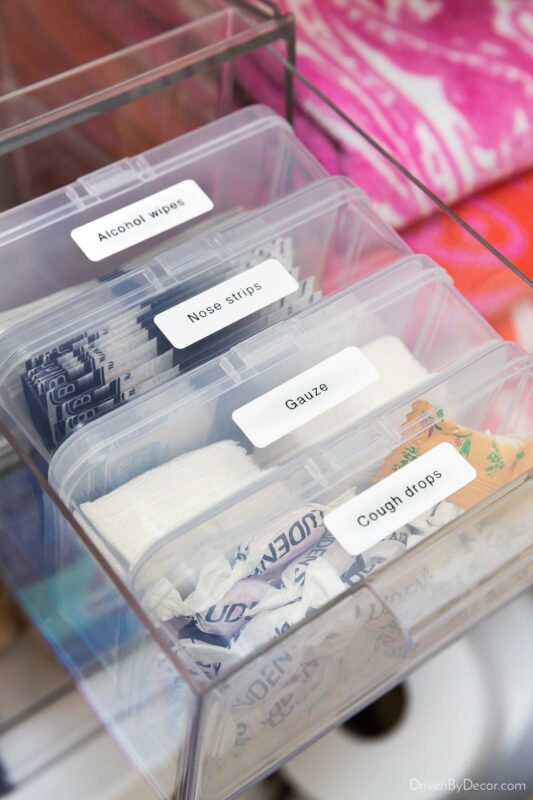
Find the location of a particular element. Image resolution: width=533 pixels, height=800 pixels. toilet paper roll is located at coordinates (432, 748).